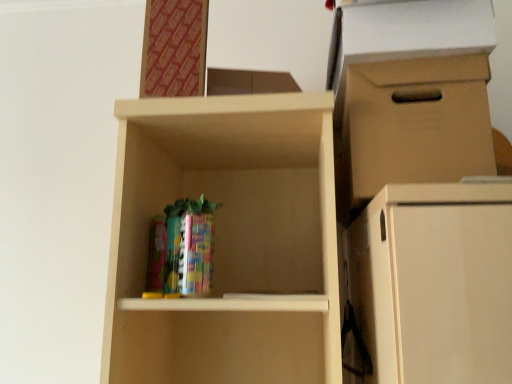
Question: Should I look upward or downward to see brown cardboard box at upper right?

Choices:
 (A) up
 (B) down

Answer: (A)